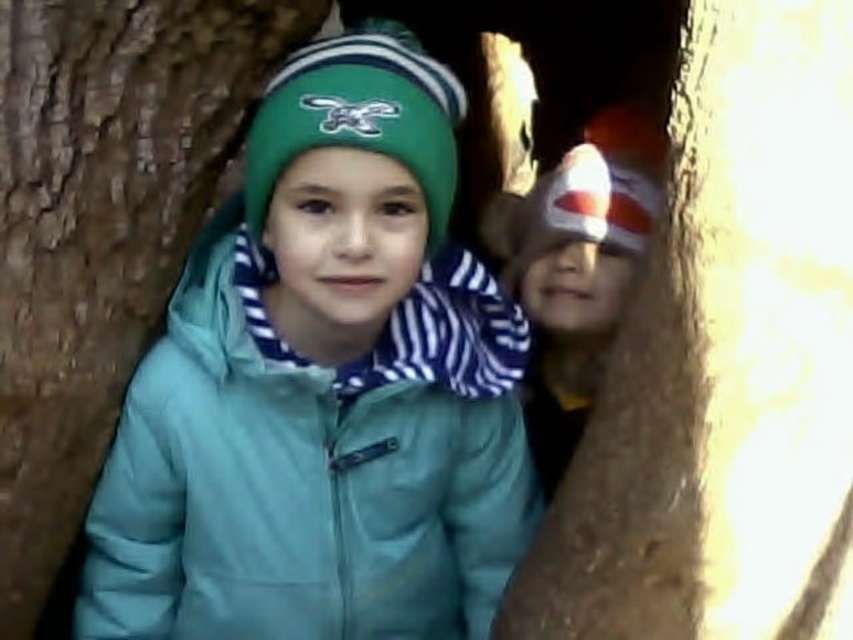
Is brown rough tree trunk at left taller than matte plastic toy at center?

Yes, brown rough tree trunk at left is taller than matte plastic toy at center.

Based on the photo, between brown rough tree trunk at left and matte plastic toy at center, which one has more height?

brown rough tree trunk at left is taller.

Image resolution: width=853 pixels, height=640 pixels. Identify the location of brown rough tree trunk at left. (102, 227).

What are the coordinates of `brown rough tree trunk at left` in the screenshot? It's located at (102, 227).

Is teal matte jacket at center thinner than matte plastic toy at center?

In fact, teal matte jacket at center might be wider than matte plastic toy at center.

Is point (251, 556) positioned behind point (577, 397)?

No.

Which is behind, point (480, 604) or point (630, 291)?

Point (630, 291)

This screenshot has height=640, width=853. What are the coordinates of `teal matte jacket at center` in the screenshot? It's located at (296, 486).

Is brown rough bark at right shorter than teal matte jacket at center?

Incorrect, brown rough bark at right's height does not fall short of teal matte jacket at center's.

Measure the distance between brown rough bark at right and teal matte jacket at center.

The distance of brown rough bark at right from teal matte jacket at center is 21.76 inches.

Does point (799, 403) come farther from viewer compared to point (425, 394)?

No, it is in front of (425, 394).

Where is `brown rough bark at right`? This screenshot has height=640, width=853. brown rough bark at right is located at coordinates (724, 362).